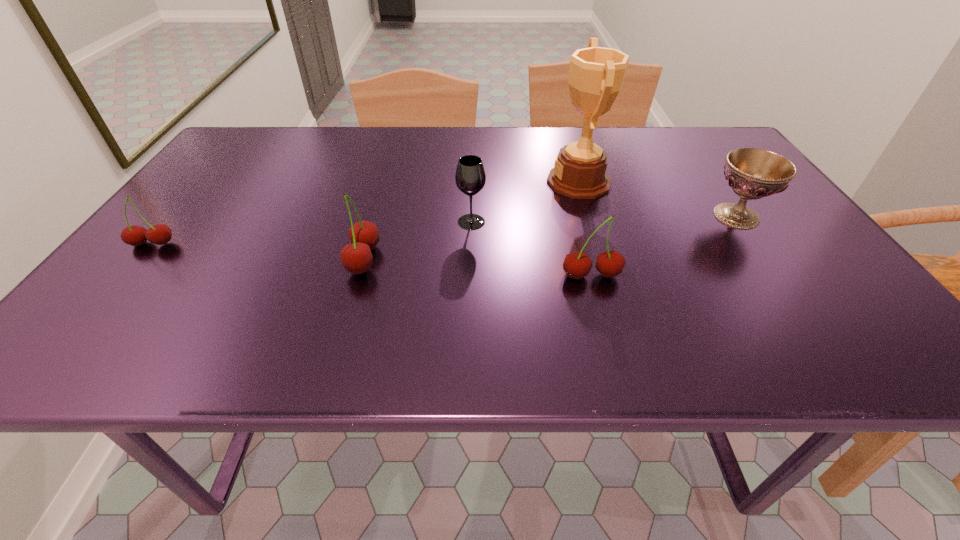
Identify the location of vacant space located on the surface of the second cherry from left to right. (272, 259).

Image resolution: width=960 pixels, height=540 pixels. I want to click on vacant position located on the surface of the rightmost cherry, so click(600, 308).

At what (x,y) coordinates should I click in order to perform the action: click on free space located on the left of the chalice. Please return your answer as a coordinate pair (x, y). The height and width of the screenshot is (540, 960). Looking at the image, I should click on (617, 216).

Where is `vacant space located on the left of the third object from left to right`? Image resolution: width=960 pixels, height=540 pixels. vacant space located on the left of the third object from left to right is located at coordinates (341, 222).

Image resolution: width=960 pixels, height=540 pixels. I want to click on free space located 0.060m on the front-facing side of the award, so click(x=523, y=181).

The width and height of the screenshot is (960, 540). Identify the location of vacant space situated 0.130m on the front-facing side of the award. (496, 181).

At what (x,y) coordinates should I click in order to perform the action: click on vacant area situated on the front-facing side of the award. Please return your answer as a coordinate pair (x, y). Looking at the image, I should click on (416, 181).

The width and height of the screenshot is (960, 540). What are the coordinates of `object located at the far edge` in the screenshot? It's located at (596, 74).

The height and width of the screenshot is (540, 960). I want to click on object that is positioned at the near edge, so click(577, 265).

You are a GUI agent. You are given a task and a screenshot of the screen. Output one action in this format:
    pyautogui.click(x=<x>, y=<y>)
    Task: Click on the object situated at the left edge
    The height and width of the screenshot is (540, 960).
    Given the screenshot: What is the action you would take?
    pyautogui.click(x=159, y=234)